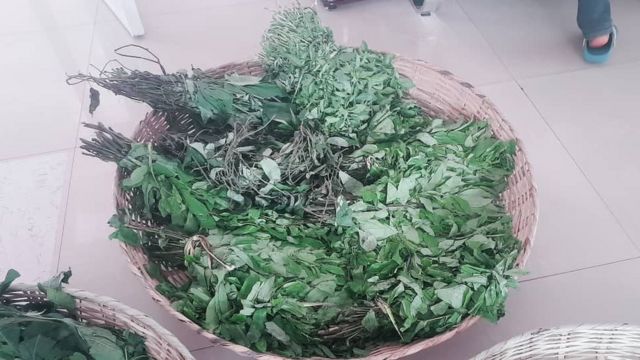
This screenshot has width=640, height=360. In order to click on damaged edge of floor tile in this screenshot , I will do `click(521, 88)`.